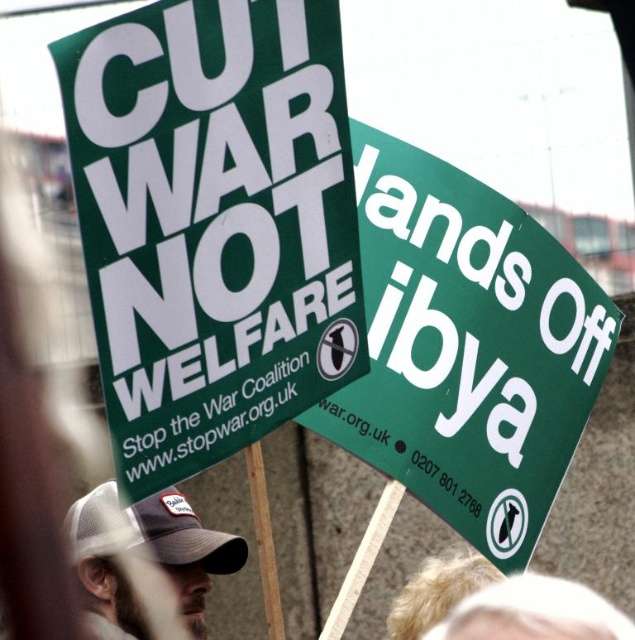
Question: Is green paper sign at upper left to the left of green paper sign at upper center from the viewer's perspective?

Choices:
 (A) no
 (B) yes

Answer: (B)

Question: Can you confirm if green paper sign at upper left is positioned above white mesh baseball cap at lower left?

Choices:
 (A) no
 (B) yes

Answer: (B)

Question: Is green paper sign at upper center wider than white mesh baseball cap at lower left?

Choices:
 (A) yes
 (B) no

Answer: (A)

Question: Which point is closer to the camera taking this photo?

Choices:
 (A) (237, 445)
 (B) (77, 500)
 (C) (552, 262)

Answer: (A)

Question: Which is nearer to the green paper sign at upper center?

Choices:
 (A) green paper sign at upper left
 (B) white mesh baseball cap at lower left

Answer: (A)

Question: Based on their relative distances, which object is farther from the green paper sign at upper center?

Choices:
 (A) green paper sign at upper left
 (B) white mesh baseball cap at lower left

Answer: (B)